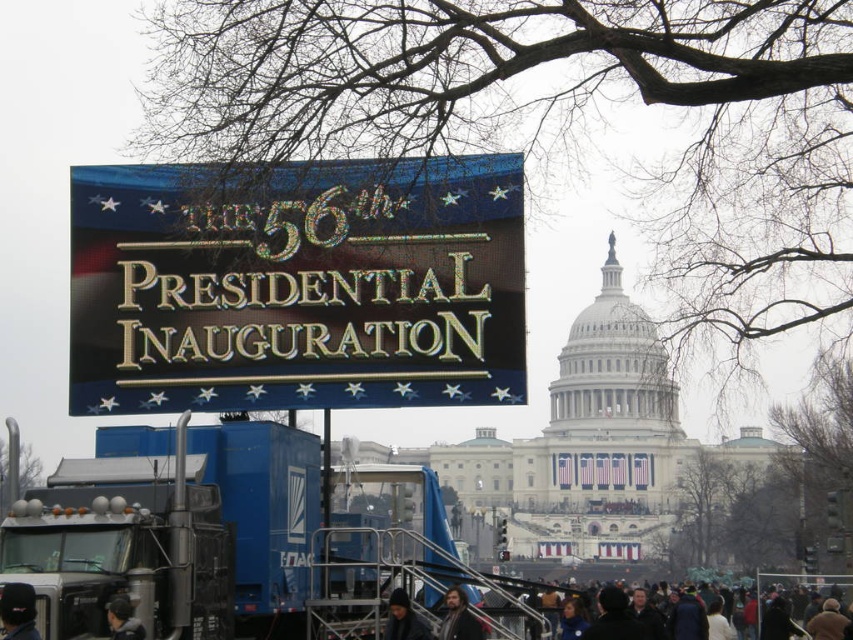
You are attending the 56th Presidential Inauguration and notice a shiny metallic sign at center and a dark brown leather jacket at lower center. From your vantage point, which object is closer to you?

The shiny metallic sign at center is closer to you because the dark brown leather jacket at lower center is behind it.

You are a photographer at the 56th Presidential Inauguration. You need to capture a wide shot that includes both the dark gray clothing at lower center and the black fabric cap at lower left. Given their sizes, which object will require more space in your camera frame?

The dark gray clothing at lower center requires more space in the camera frame because its width is larger than the black fabric cap at lower left.

You are attending the 56th Presidential Inauguration and notice two items in the scene. One is the shiny metallic sign at center and the other is the dark brown leather jacket at lower center. Which of these items is larger in size?

The shiny metallic sign at center is bigger than the dark brown leather jacket at lower center.